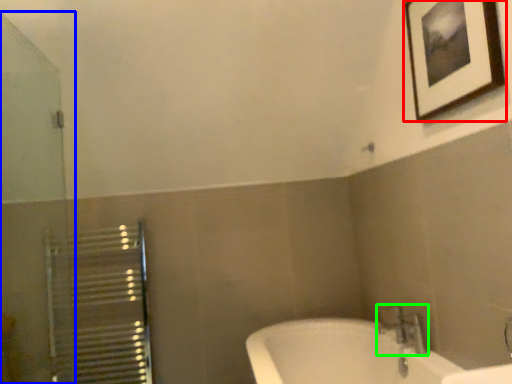
Question: Considering the real-world distances, which object is farthest from picture frame (highlighted by a red box)? screen door (highlighted by a blue box) or tap (highlighted by a green box)?

Choices:
 (A) screen door
 (B) tap

Answer: (A)